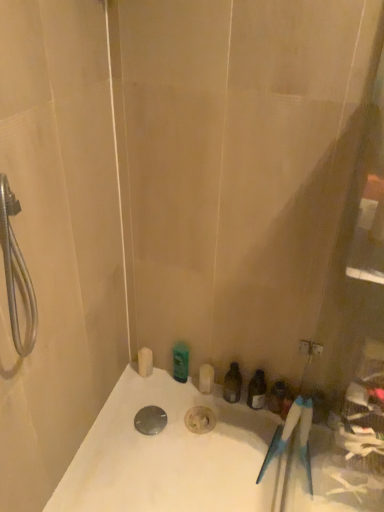
Question: Considering the positions of point (213, 487) and point (233, 387), is point (213, 487) closer or farther from the camera than point (233, 387)?

Choices:
 (A) closer
 (B) farther

Answer: (A)

Question: Is white glossy bathtub at lower center bigger or smaller than translucent plastic bottle at center, acting as the 3th toiletry starting from the left?

Choices:
 (A) small
 (B) big

Answer: (B)

Question: Considering the real-world distances, which object is closest to the white matte soap dispenser at lower left, arranged as the 4th toiletry when viewed from the right?

Choices:
 (A) polished metallic drain at center
 (B) white glossy bathtub at lower center
 (C) matte plastic toiletries at lower right, which appears as the first toiletry when viewed from the right
 (D) green matte bottle at upper center, arranged as the 3th toiletry when viewed from the right
 (E) translucent plastic bottle at center, acting as the 3th toiletry starting from the left

Answer: (D)

Question: Estimate the real-world distances between objects in this image. Which object is closer to the white glossy bathtub at lower center?

Choices:
 (A) green matte bottle at upper center, the second toiletry in the left-to-right sequence
 (B) white matte soap dispenser at lower left, the 1th toiletry from the left
 (C) translucent plastic bottle at center, which is the second toiletry in right-to-left order
 (D) polished metallic drain at center
 (E) matte plastic toiletries at lower right, which appears as the first toiletry when viewed from the right

Answer: (D)